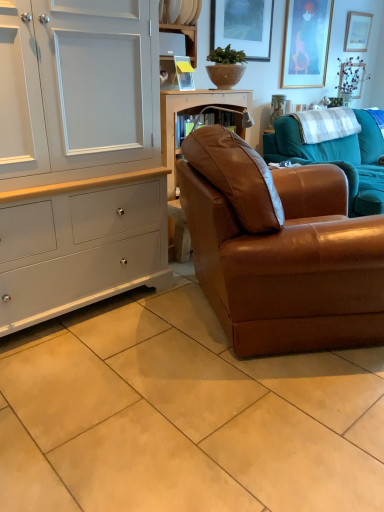
Locate an element on the screen. The image size is (384, 512). vacant region to the left of brown leather couch at right, the 2th studio couch from the back is located at coordinates (119, 352).